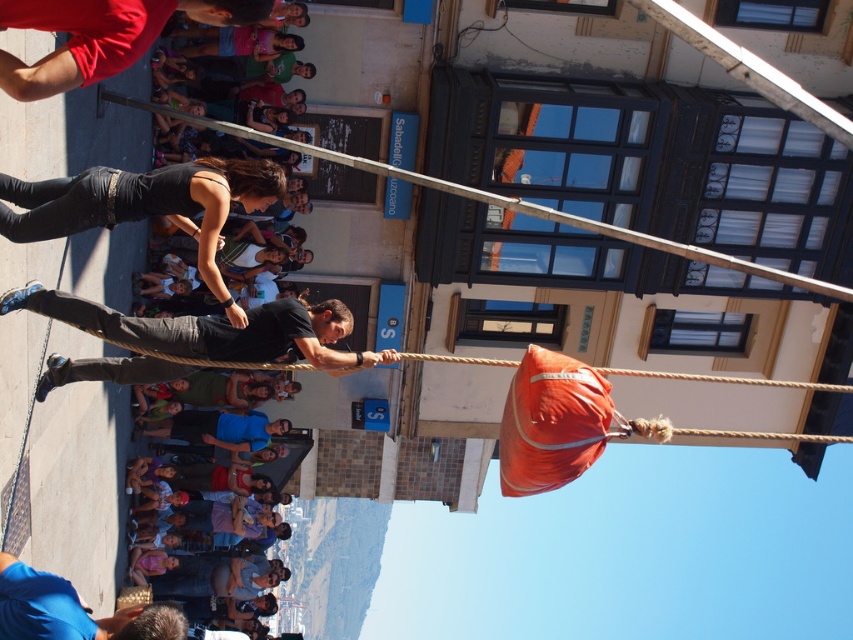
Who is positioned more to the right, black matte shirt at center or red fabric shirt at upper left?

Positioned to the right is black matte shirt at center.

Describe the element at coordinates (213, 330) in the screenshot. This screenshot has height=640, width=853. I see `black matte shirt at center` at that location.

In order to click on black matte shirt at center in this screenshot , I will do `click(213, 330)`.

Measure the distance between point (x=3, y=60) and camera.

Point (x=3, y=60) is 29.94 meters from camera.

Who is taller, red fabric shirt at upper left or orange fabric bag at center?

→ orange fabric bag at center

Who is more distant from viewer, (97, 49) or (688, 374)?

The point (688, 374) is more distant.

At what (x,y) coordinates should I click in order to perform the action: click on red fabric shirt at upper left. Please return your answer as a coordinate pair (x, y). The image size is (853, 640). Looking at the image, I should click on (102, 36).

Is point (141, 317) in front of point (705, 378)?

No, it is behind (705, 378).

Who is shorter, black matte shirt at center or orange fabric bag at center?

orange fabric bag at center

Does point (270, 307) lie behind point (688, 376)?

Yes, point (270, 307) is farther from viewer.

Image resolution: width=853 pixels, height=640 pixels. What are the coordinates of `black matte shirt at center` in the screenshot? It's located at (x=213, y=330).